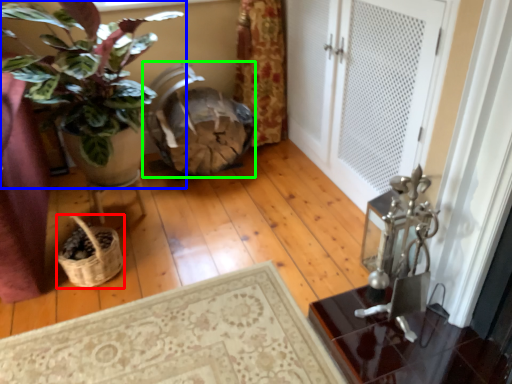
Question: Considering the real-world distances, which object is closest to basket (highlighted by a red box)? houseplant (highlighted by a blue box) or rocking chair (highlighted by a green box).

Choices:
 (A) houseplant
 (B) rocking chair

Answer: (A)